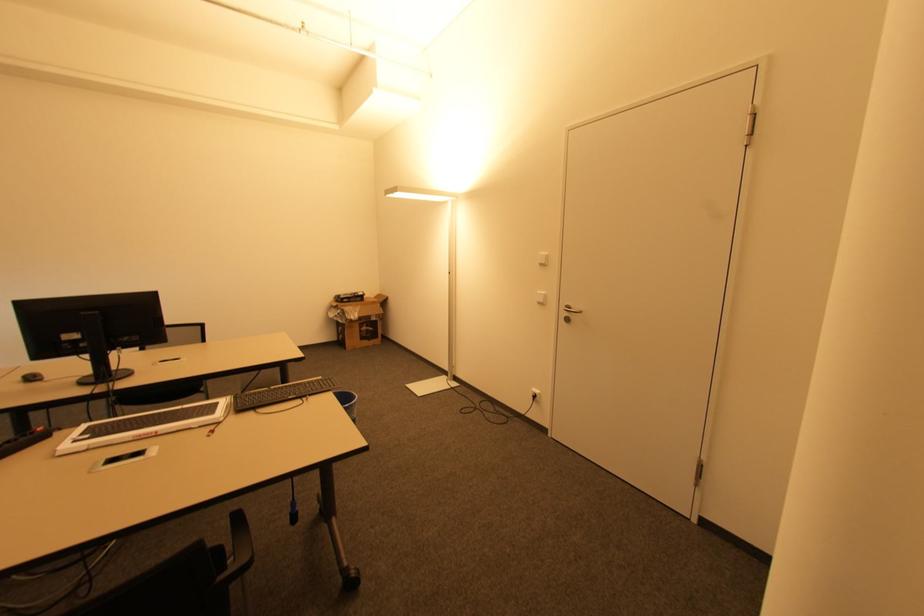
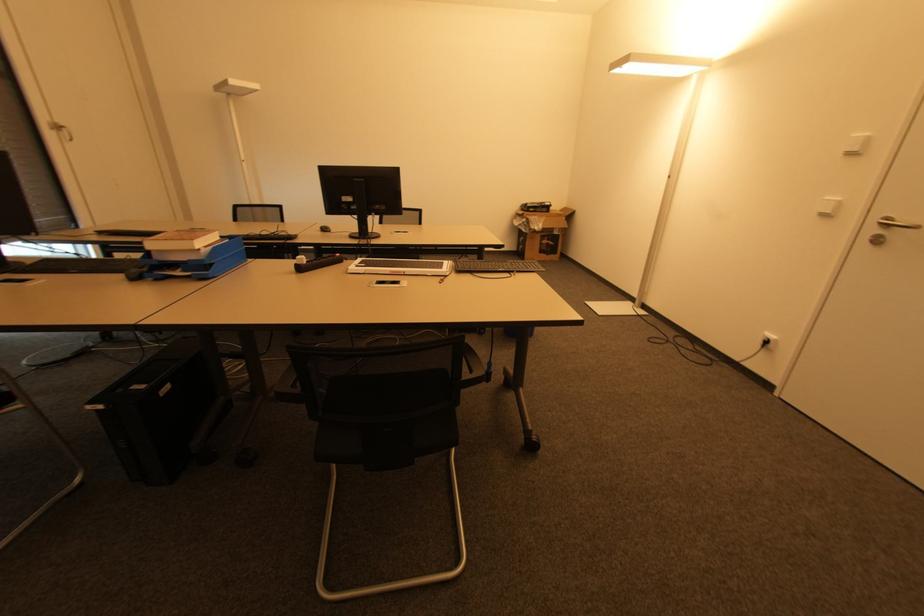
The point at (369, 331) is marked in the first image. Where is the corresponding point in the second image?

(550, 245)